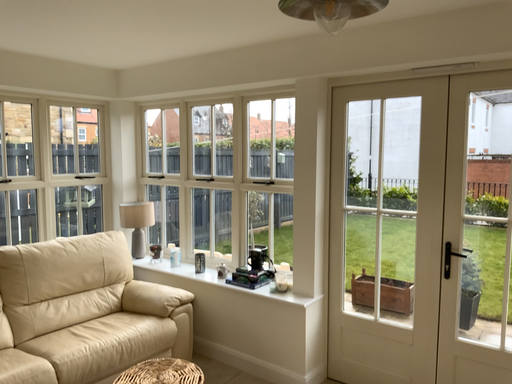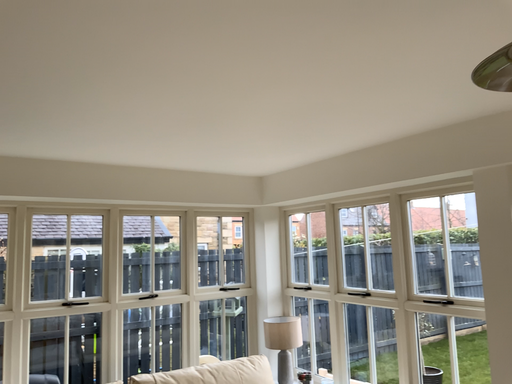
Question: How did the camera likely rotate when shooting the video?

Choices:
 (A) rotated downward
 (B) rotated upward

Answer: (B)